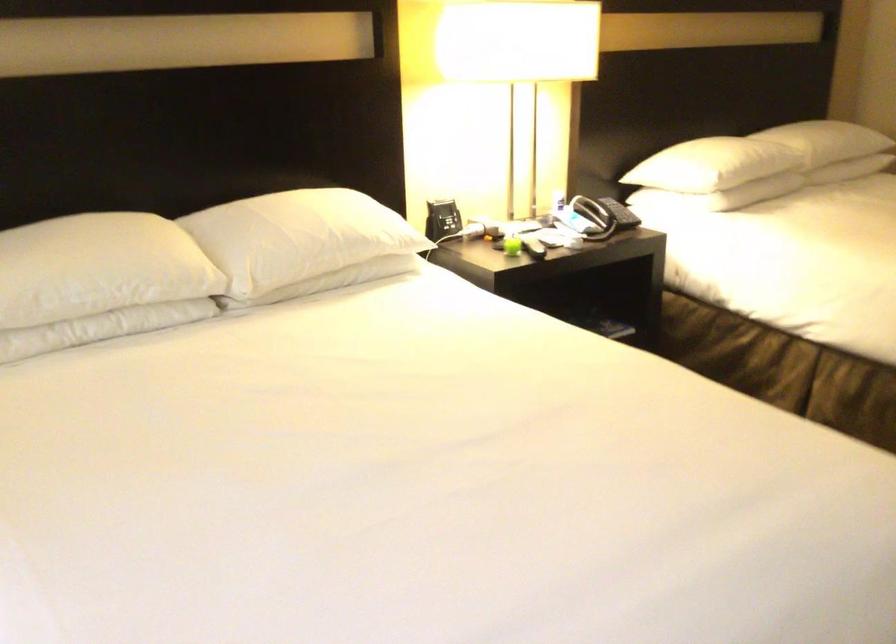
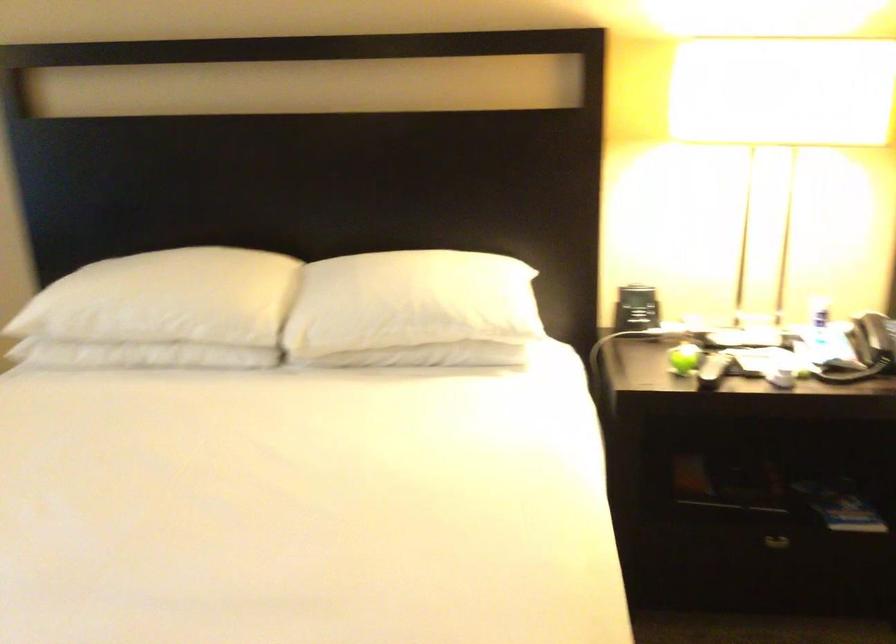
The point at (130, 269) is marked in the first image. Where is the corresponding point in the second image?

(186, 305)